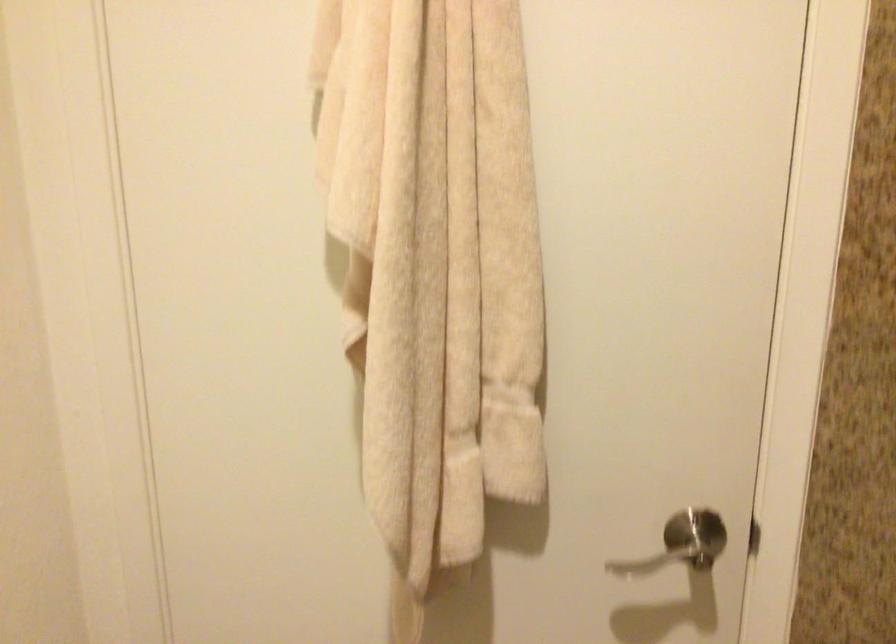
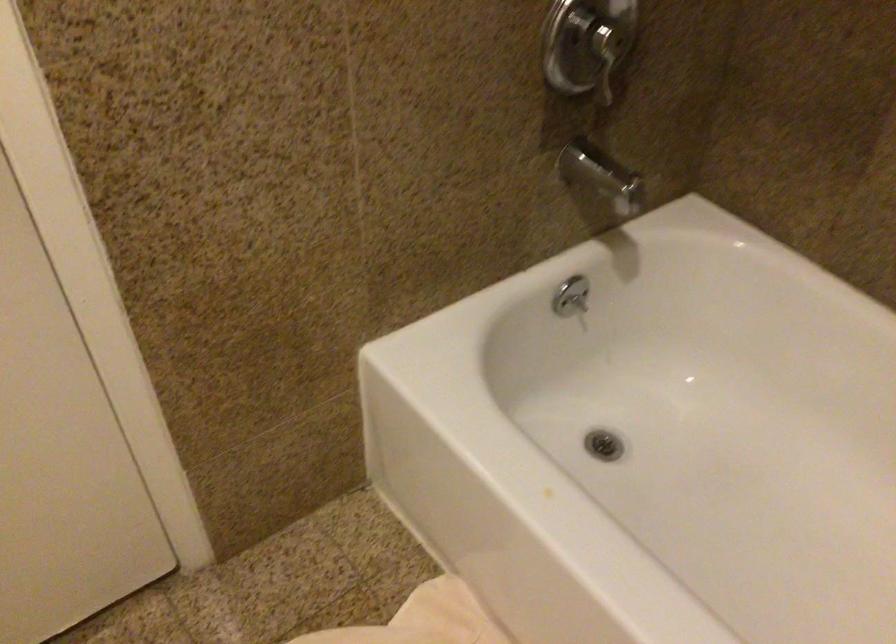
How did the camera likely rotate?

The camera's rotation is toward right-down.